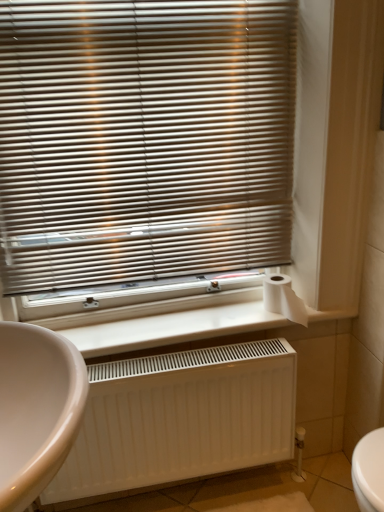
Where is `white matte radiator at lower center`? This screenshot has height=512, width=384. white matte radiator at lower center is located at coordinates (173, 328).

The width and height of the screenshot is (384, 512). What do you see at coordinates (36, 409) in the screenshot?
I see `beige glossy sink at lower left` at bounding box center [36, 409].

Identify the location of white matte radiator at lower center. The height and width of the screenshot is (512, 384). pyautogui.click(x=173, y=328).

Between white matte toilet paper at right and metallic blinds at upper center, which one has larger width?

white matte toilet paper at right is wider.

The width and height of the screenshot is (384, 512). Find the location of `window blind that is above the white matte toilet paper at right (from a real-world perspective)`. window blind that is above the white matte toilet paper at right (from a real-world perspective) is located at coordinates (144, 140).

Who is bigger, white matte toilet paper at right or metallic blinds at upper center?

With larger size is metallic blinds at upper center.

Which object is more forward, white matte toilet paper at right or metallic blinds at upper center?

metallic blinds at upper center is closer to the camera.

Is beige glossy sink at lower left positioned far away from white matte toilet paper at right?

They are positioned close to each other.

Which object is further away from the camera, beige glossy sink at lower left or white matte toilet paper at right?

white matte toilet paper at right is behind.

From the image's perspective, is beige glossy sink at lower left above or below white matte toilet paper at right?

From the image's perspective, beige glossy sink at lower left appears below white matte toilet paper at right.

Visually, is white matte radiator at lower center positioned to the left or to the right of beige glossy sink at lower left?

In the image, white matte radiator at lower center appears on the right side of beige glossy sink at lower left.

Does white matte radiator at lower center have a greater width compared to beige glossy sink at lower left?

No.

Is white matte radiator at lower center looking in the opposite direction of beige glossy sink at lower left?

white matte radiator at lower center does not have its back to beige glossy sink at lower left.

Does point (228, 331) come farther from viewer compared to point (28, 433)?

Yes, point (228, 331) is farther from viewer.

Is metallic blinds at upper center oriented away from white matte radiator at lower center?

No.

From the picture: From a real-world perspective, which is physically below, metallic blinds at upper center or white matte radiator at lower center?

white matte radiator at lower center is physically lower.

Is metallic blinds at upper center to the left or to the right of white matte radiator at lower center in the image?

metallic blinds at upper center is to the left of white matte radiator at lower center.

How far apart are beige glossy sink at lower left and white matte radiator at lower center?

beige glossy sink at lower left is 20.69 inches away from white matte radiator at lower center.

Considering the sizes of beige glossy sink at lower left and white matte radiator at lower center in the image, is beige glossy sink at lower left wider or thinner than white matte radiator at lower center?

Considering their sizes, beige glossy sink at lower left looks broader than white matte radiator at lower center.

Is beige glossy sink at lower left positioned with its back to white matte radiator at lower center?

beige glossy sink at lower left does not have its back to white matte radiator at lower center.

How many degrees apart are the facing directions of beige glossy sink at lower left and white matte radiator at lower center?

The angle between the facing direction of beige glossy sink at lower left and the facing direction of white matte radiator at lower center is 90.6 degrees.

Considering the sizes of white matte radiator at lower center and white matte radiator at lower center in the image, is white matte radiator at lower center taller or shorter than white matte radiator at lower center?

Considering their sizes, white matte radiator at lower center has more height than white matte radiator at lower center.

Does white matte radiator at lower center turn towards white matte radiator at lower center?

No, white matte radiator at lower center does not turn towards white matte radiator at lower center.

Are white matte toilet paper at right and white matte radiator at lower center making contact?

There is a gap between white matte toilet paper at right and white matte radiator at lower center.

Locate an element on the screen. The width and height of the screenshot is (384, 512). toilet paper above the white matte radiator at lower center (from a real-world perspective) is located at coordinates (283, 298).

Would you say white matte toilet paper at right is to the left or to the right of white matte radiator at lower center in the picture?

white matte toilet paper at right is positioned on white matte radiator at lower center's right side.

Which of these two, white matte toilet paper at right or white matte radiator at lower center, stands taller?

Standing taller between the two is white matte radiator at lower center.

Locate an element on the screen. toilet paper below the metallic blinds at upper center (from the image's perspective) is located at coordinates (283, 298).

Find the location of `toilet paper lying behind the beige glossy sink at lower left`. toilet paper lying behind the beige glossy sink at lower left is located at coordinates (283, 298).

From the picture: Which object lies further to the anchor point white matte toilet paper at right, white matte radiator at lower center or metallic blinds at upper center?

metallic blinds at upper center.

Based on the photo, from the image, which object appears to be farther from white matte toilet paper at right, white matte radiator at lower center or white matte radiator at lower center?

white matte radiator at lower center is further to white matte toilet paper at right.

Based on the photo, estimate the real-world distances between objects in this image. Which object is closer to white matte toilet paper at right, metallic blinds at upper center or white matte radiator at lower center?

white matte radiator at lower center lies closer to white matte toilet paper at right than the other object.

When comparing their distances from metallic blinds at upper center, does white matte radiator at lower center or beige glossy sink at lower left seem further?

The object further to metallic blinds at upper center is beige glossy sink at lower left.

Estimate the real-world distances between objects in this image. Which object is closer to white matte radiator at lower center, beige glossy sink at lower left or white matte radiator at lower center?

white matte radiator at lower center lies closer to white matte radiator at lower center than the other object.

From the image, which object appears to be nearer to beige glossy sink at lower left, white matte toilet paper at right or metallic blinds at upper center?

metallic blinds at upper center is closer to beige glossy sink at lower left.

Based on their spatial positions, is white matte toilet paper at right or white matte radiator at lower center further from metallic blinds at upper center?

white matte toilet paper at right.

Estimate the real-world distances between objects in this image. Which object is closer to metallic blinds at upper center, beige glossy sink at lower left or white matte radiator at lower center?

white matte radiator at lower center is closer to metallic blinds at upper center.

Locate an element on the screen. counter top located between beige glossy sink at lower left and white matte toilet paper at right in the depth direction is located at coordinates (173, 328).

Identify the location of counter top between metallic blinds at upper center and white matte radiator at lower center in the up-down direction. (173, 328).

Image resolution: width=384 pixels, height=512 pixels. What are the coordinates of `window blind located between beige glossy sink at lower left and white matte toilet paper at right in the depth direction` in the screenshot? It's located at (144, 140).

Locate an element on the screen. sink between metallic blinds at upper center and white matte radiator at lower center from top to bottom is located at coordinates (36, 409).